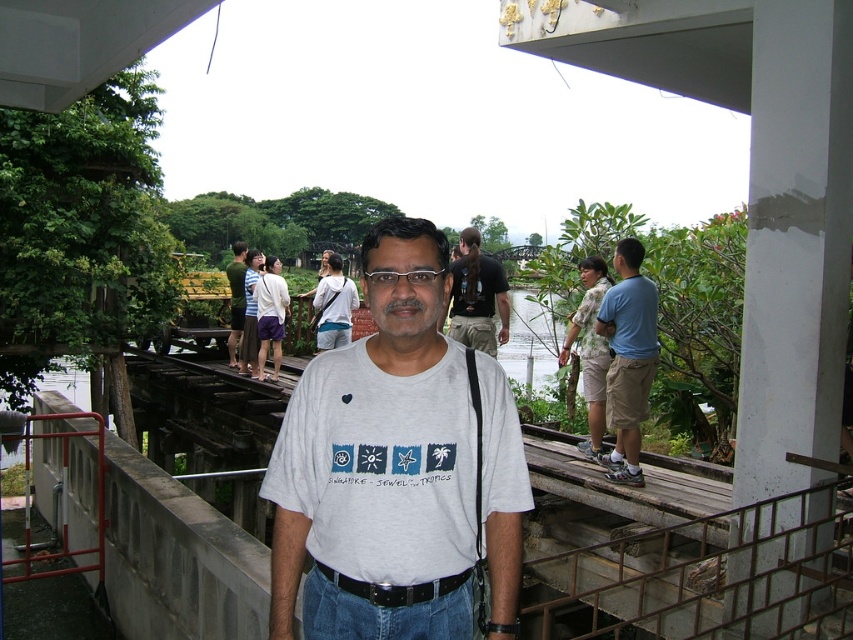
You are a photographer standing at the riverside walkway. You want to take a photo of the concrete railing at center and the green fabric shirt at center. Which object is shorter in height?

The concrete railing at center has a lesser height compared to the green fabric shirt at center, so the concrete railing at center is shorter in height.

You are standing at the riverside walkway and want to take a photo of the concrete railing at center. Based on its position, where should you aim your camera to capture it in the frame?

The concrete railing at center is located at point (706, 576), so you should aim your camera towards the center of the scene to capture it.

You are a photographer standing at the riverside. You notice the concrete railing at center and the black leather belt at center. Which object would block your view more if placed between you and the background?

The concrete railing at center is bigger than the black leather belt at center, so it would block your view more.